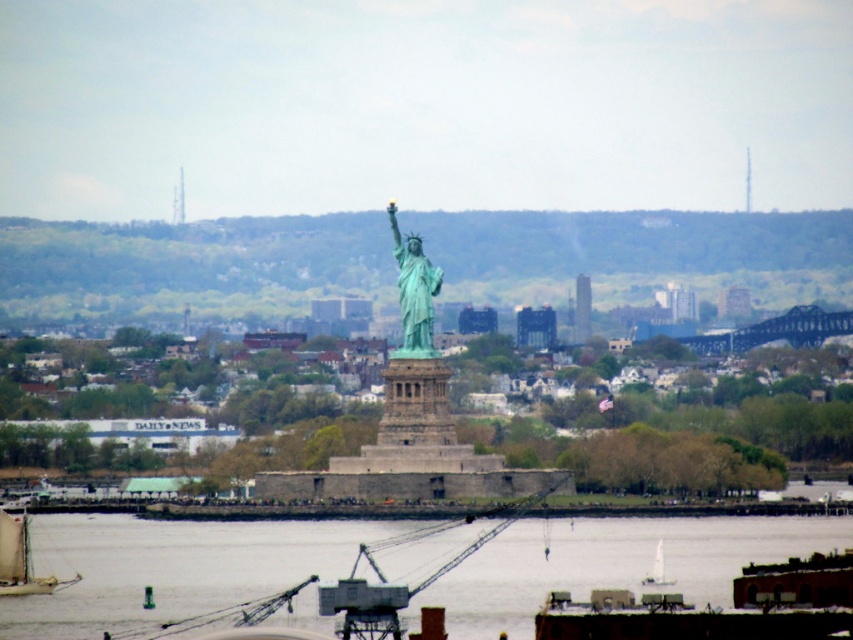
Is point (431, 316) farther from viewer compared to point (42, 577)?

No, it is in front of (42, 577).

Who is positioned more to the right, green patina statue at center or wooden sailboat at lower left?

green patina statue at center

Is point (422, 259) closer to viewer compared to point (13, 531)?

Yes, it is in front of point (13, 531).

The height and width of the screenshot is (640, 853). In order to click on green patina statue at center in this screenshot , I will do `click(415, 292)`.

Who is positioned more to the left, clear water at lower center or wooden sailboat at lower left?

Positioned to the left is wooden sailboat at lower left.

Is clear water at lower center to the right of wooden sailboat at lower left from the viewer's perspective?

Indeed, clear water at lower center is positioned on the right side of wooden sailboat at lower left.

Who is more forward, (592, 577) or (16, 516)?

Point (592, 577)

Locate an element on the screen. This screenshot has height=640, width=853. clear water at lower center is located at coordinates (171, 566).

Can you confirm if clear water at lower center is positioned below white plastic boat at lower center?

No.

Can you confirm if clear water at lower center is thinner than white plastic boat at lower center?

No, clear water at lower center is not thinner than white plastic boat at lower center.

Who is more forward, (682, 522) or (660, 566)?

Point (660, 566) is more forward.

Identify the location of clear water at lower center. This screenshot has width=853, height=640. (171, 566).